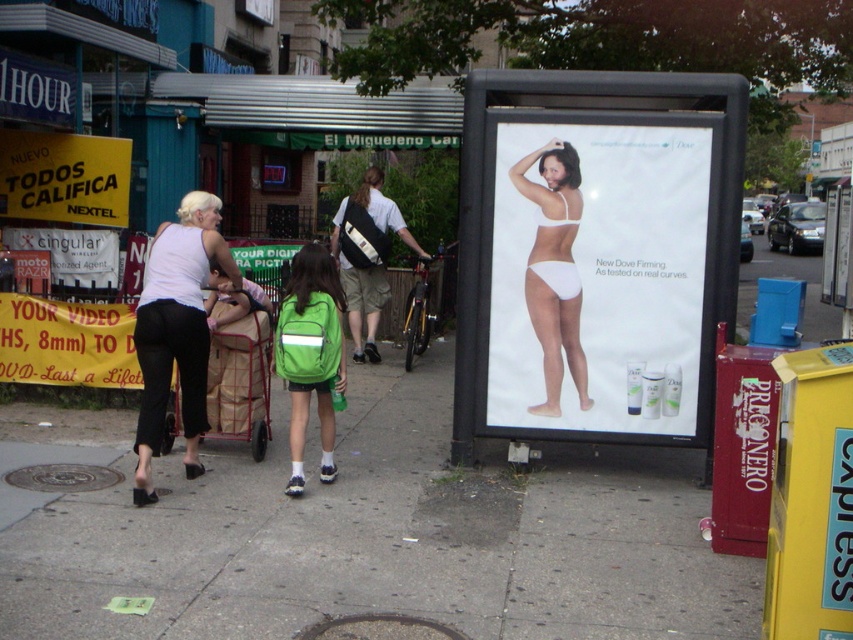
Does point (216, 234) lie in front of point (126, 147)?

Yes, it is.

Locate an element on the screen. The image size is (853, 640). white cotton tank top at left is located at coordinates (177, 330).

Is point (190, 388) more distant than point (126, 193)?

No, (190, 388) is closer to viewer.

The width and height of the screenshot is (853, 640). What are the coordinates of `white cotton tank top at left` in the screenshot? It's located at (177, 330).

Is point (149, 266) closer to camera compared to point (573, 276)?

That is True.

Between white cotton tank top at left and white fabric underwear at center, which one has more height?

Standing taller between the two is white cotton tank top at left.

Image resolution: width=853 pixels, height=640 pixels. Describe the element at coordinates (177, 330) in the screenshot. I see `white cotton tank top at left` at that location.

Identify the location of white cotton tank top at left. This screenshot has width=853, height=640. (177, 330).

Does point (508, 579) come farther from viewer compared to point (142, 346)?

That is False.

Between concrete at center and white cotton tank top at left, which one appears on the right side from the viewer's perspective?

concrete at center

This screenshot has width=853, height=640. Identify the location of concrete at center. (367, 531).